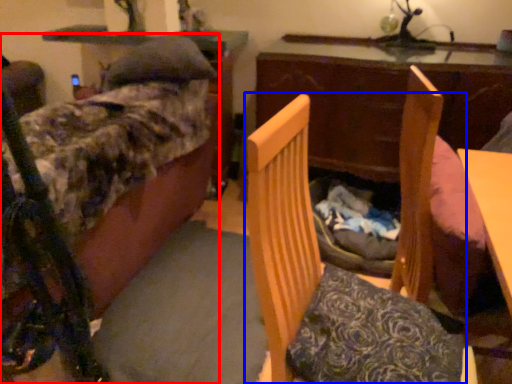
Question: Which point is further to the camera, furniture (highlighted by a red box) or furniture (highlighted by a blue box)?

Choices:
 (A) furniture
 (B) furniture

Answer: (A)